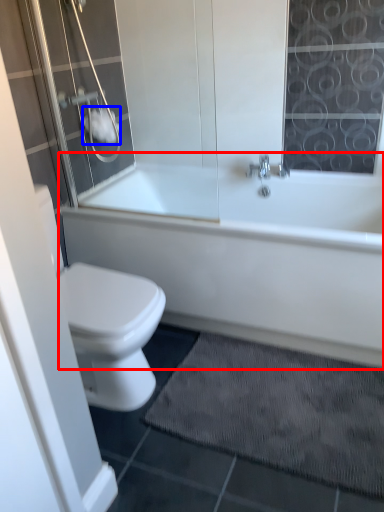
Question: Which object is closer to the camera taking this photo, bathtub (highlighted by a red box) or toilet paper (highlighted by a blue box)?

Choices:
 (A) bathtub
 (B) toilet paper

Answer: (A)